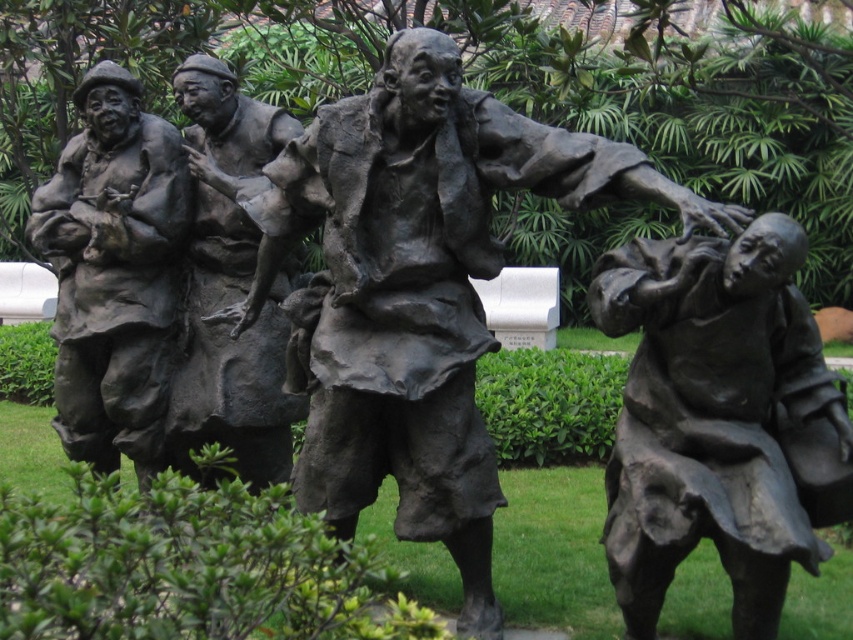
You are an art curator planning to place the bronze statue at right and the bronze statue of man at center in a gallery. Which statue should be placed on a higher pedestal to ensure both appear balanced in height?

The bronze statue at right is shorter than the bronze statue of man at center. To balance their heights, the bronze statue at right should be placed on a higher pedestal.

Looking at this image, you are standing in front of the bronze sculpture and want to take a photo of the bronze statue at right. If your camera can focus on objects up to 10 feet away, will you need to step back to take the photo?

The bronze statue at right is 10.44 feet away from the viewer. Since the camera can focus up to 10 feet, you need to step back to increase the distance so the statue is within the camera range.